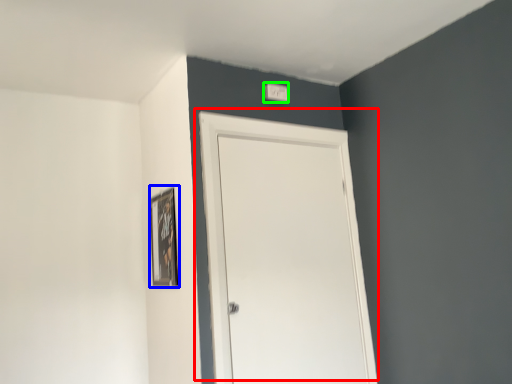
Question: Which object is the farthest from door (highlighted by a red box)? Choose among these: picture frame (highlighted by a blue box) or light switch (highlighted by a green box).

Choices:
 (A) picture frame
 (B) light switch

Answer: (B)